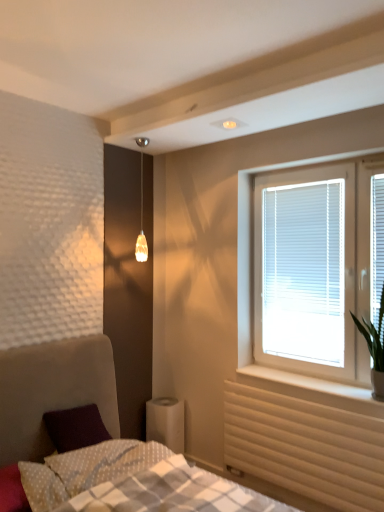
Describe the element at coordinates (98, 444) in the screenshot. I see `white textured bed at lower left` at that location.

This screenshot has height=512, width=384. What do you see at coordinates (251, 243) in the screenshot? I see `white blinds at right` at bounding box center [251, 243].

In order to face white wood window sill at lower right, should I rotate leftwards or rightwards?

To face it directly, rotate right by 15.425 degrees.

I want to click on white wood window sill at lower right, so click(x=312, y=389).

You are a GUI agent. You are given a task and a screenshot of the screen. Output one action in this format:
    pyautogui.click(x=<x>, y=<y>)
    Task: Click on the translucent amber glass pendant light at upper center
    The height and width of the screenshot is (512, 384).
    Given the screenshot: What is the action you would take?
    pyautogui.click(x=141, y=229)

Considering the positions of objects white blinds at right and translucent amber glass pendant light at upper center in the image provided, who is more to the left, white blinds at right or translucent amber glass pendant light at upper center?

translucent amber glass pendant light at upper center is more to the left.

Does point (237, 324) lie behind point (147, 252)?

No, (237, 324) is in front of (147, 252).

From the image's perspective, is white blinds at right located above or below translucent amber glass pendant light at upper center?

From the image's perspective, white blinds at right appears below translucent amber glass pendant light at upper center.

Would you say translucent amber glass pendant light at upper center is part of white blinds at right's contents?

No.

This screenshot has width=384, height=512. I want to click on bed above the white dotted fabric pillow at lower left, the 2th pillow positioned from the right (from a real-world perspective), so click(98, 444).

Is white dotted fabric pillow at lower left, the 2th pillow positioned from the right, not close to white textured bed at lower left?

That's not correct — white dotted fabric pillow at lower left, the 2th pillow positioned from the right, is a little close to white textured bed at lower left.

Is point (58, 493) closer or farther from the camera than point (237, 509)?

Point (58, 493).

From the image's perspective, would you say white dotted fabric pillow at lower left, which is counted as the 1th pillow, starting from the left, is positioned over white textured bed at lower left?

No, from the image's perspective, white dotted fabric pillow at lower left, which is counted as the 1th pillow, starting from the left, is not on top of white textured bed at lower left.

Is translucent amber glass pendant light at upper center turned away from white dotted fabric pillow at lower left, which is counted as the 1th pillow, starting from the left?

No, translucent amber glass pendant light at upper center's orientation is not away from white dotted fabric pillow at lower left, which is counted as the 1th pillow, starting from the left.

Which is closer to the camera, (142, 147) or (62, 488)?

Positioned in front is point (62, 488).

Is translucent amber glass pendant light at upper center positioned beyond the bounds of white dotted fabric pillow at lower left, the 2th pillow positioned from the right?

Absolutely, translucent amber glass pendant light at upper center is external to white dotted fabric pillow at lower left, the 2th pillow positioned from the right.

Looking at the image, does translucent amber glass pendant light at upper center seem bigger or smaller compared to white dotted fabric pillow at lower left, the 2th pillow positioned from the right?

Considering their sizes, translucent amber glass pendant light at upper center takes up less space than white dotted fabric pillow at lower left, the 2th pillow positioned from the right.

Is white plastic blinds at upper right, the second window screen from the front, far from white dotted fabric pillow at lower left, the 2th pillow positioned from the right?

That's right, there is a large distance between white plastic blinds at upper right, the second window screen from the front, and white dotted fabric pillow at lower left, the 2th pillow positioned from the right.

Between white plastic blinds at upper right, positioned as the first window screen in back-to-front order, and white dotted fabric pillow at lower left, the 2th pillow positioned from the right, which one has smaller size?

With smaller size is white dotted fabric pillow at lower left, the 2th pillow positioned from the right.

From their relative heights in the image, would you say white plastic blinds at upper right, the second window screen from the front, is taller or shorter than white dotted fabric pillow at lower left, the 2th pillow positioned from the right?

Clearly, white plastic blinds at upper right, the second window screen from the front, is taller compared to white dotted fabric pillow at lower left, the 2th pillow positioned from the right.

Is the depth of white plastic blinds at upper right, arranged as the second window screen when viewed from the right, greater than that of white dotted fabric pillow at lower left, the 2th pillow positioned from the right?

Yes, it is behind white dotted fabric pillow at lower left, the 2th pillow positioned from the right.

Which is correct: white plastic blinds at right, placed as the 2th window screen when sorted from left to right, is inside white plastic blinds at upper right, arranged as the second window screen when viewed from the right, or outside of it?

white plastic blinds at right, placed as the 2th window screen when sorted from left to right, is not enclosed by white plastic blinds at upper right, arranged as the second window screen when viewed from the right.

From a real-world perspective, does white plastic blinds at right, which appears as the first window screen when viewed from the right, sit lower than white plastic blinds at upper right, positioned as the first window screen in back-to-front order?

Incorrect, from a real-world perspective, white plastic blinds at right, which appears as the first window screen when viewed from the right, is higher than white plastic blinds at upper right, positioned as the first window screen in back-to-front order.

Considering the sizes of white plastic blinds at right, placed as the 2th window screen when sorted from left to right, and white plastic blinds at upper right, arranged as the second window screen when viewed from the right, in the image, is white plastic blinds at right, placed as the 2th window screen when sorted from left to right, taller or shorter than white plastic blinds at upper right, arranged as the second window screen when viewed from the right,?

white plastic blinds at right, placed as the 2th window screen when sorted from left to right, is shorter than white plastic blinds at upper right, arranged as the second window screen when viewed from the right.

Can you see white plastic blinds at right, placed as the 2th window screen when sorted from left to right, touching white plastic blinds at upper right, positioned as the first window screen in back-to-front order?

No.

Is white textured bed at lower left not near velvet purple pillow at lower left, which is the 1th pillow in right-to-left order?

No.

Based on their sizes in the image, would you say white textured bed at lower left is bigger or smaller than velvet purple pillow at lower left, which is the 1th pillow in right-to-left order?

Considering their sizes, white textured bed at lower left takes up more space than velvet purple pillow at lower left, which is the 1th pillow in right-to-left order.

From the picture: Is white textured bed at lower left to the right of velvet purple pillow at lower left, positioned as the 2th pillow in left-to-right order, from the viewer's perspective?

Yes, white textured bed at lower left is to the right of velvet purple pillow at lower left, positioned as the 2th pillow in left-to-right order.

Which is closer to the camera, (x=142, y=462) or (x=157, y=454)?

The point (x=142, y=462) is more forward.

Is white dotted fabric pillow at lower left, which is counted as the 1th pillow, starting from the left, in contact with white plastic blinds at right, placed as the 2th window screen when sorted from left to right?

No, white dotted fabric pillow at lower left, which is counted as the 1th pillow, starting from the left, is not beside white plastic blinds at right, placed as the 2th window screen when sorted from left to right.

Between white dotted fabric pillow at lower left, which is counted as the 1th pillow, starting from the left, and white plastic blinds at right, which appears as the first window screen when viewed from the right, which one has smaller size?

Smaller between the two is white plastic blinds at right, which appears as the first window screen when viewed from the right.

Is white dotted fabric pillow at lower left, which is counted as the 1th pillow, starting from the left, positioned with its back to white plastic blinds at right, which appears as the first window screen when viewed from the right?

No, white dotted fabric pillow at lower left, which is counted as the 1th pillow, starting from the left, is not facing away from white plastic blinds at right, which appears as the first window screen when viewed from the right.

The image size is (384, 512). What are the coordinates of `lamp that is above the white blinds at right (from the image's perspective)` in the screenshot? It's located at (141, 229).

Find the location of a particular element. This screenshot has height=512, width=384. bed in front of the white dotted fabric pillow at lower left, which is counted as the 1th pillow, starting from the left is located at coordinates (98, 444).

Looking at the image, which one is located closer to white plastic blinds at right, which is the first window screen from front to back, white dotted fabric pillow at lower left, which is counted as the 1th pillow, starting from the left, or translucent amber glass pendant light at upper center?

Among the two, translucent amber glass pendant light at upper center is located nearer to white plastic blinds at right, which is the first window screen from front to back.

From the image, which object appears to be nearer to white wood window sill at lower right, white plastic blinds at upper right, the second window screen from the front, or white textured bed at lower left?

white plastic blinds at upper right, the second window screen from the front.

When comparing their distances from white dotted fabric pillow at lower left, the 2th pillow positioned from the right, does translucent amber glass pendant light at upper center or beige textured radiator at lower right seem closer?

The object closer to white dotted fabric pillow at lower left, the 2th pillow positioned from the right, is beige textured radiator at lower right.

Looking at the image, which one is located further to white dotted fabric pillow at lower left, which is counted as the 1th pillow, starting from the left, white textured bed at lower left or white plastic blinds at upper right, marked as the first window screen in a left-to-right arrangement?

white plastic blinds at upper right, marked as the first window screen in a left-to-right arrangement, is further to white dotted fabric pillow at lower left, which is counted as the 1th pillow, starting from the left.

When comparing their distances from translucent amber glass pendant light at upper center, does white textured bed at lower left or beige textured radiator at lower right seem closer?

white textured bed at lower left lies closer to translucent amber glass pendant light at upper center than the other object.

From the picture: Estimate the real-world distances between objects in this image. Which object is closer to translucent amber glass pendant light at upper center, velvet purple pillow at lower left, which is the 1th pillow in right-to-left order, or white dotted fabric pillow at lower left, the 2th pillow positioned from the right?

The object closer to translucent amber glass pendant light at upper center is velvet purple pillow at lower left, which is the 1th pillow in right-to-left order.

From the image, which object appears to be nearer to white plastic blinds at right, which is the first window screen from front to back, white blinds at right or beige textured radiator at lower right?

white blinds at right lies closer to white plastic blinds at right, which is the first window screen from front to back, than the other object.

Which object lies further to the anchor point white plastic blinds at right, which appears as the first window screen when viewed from the right, white blinds at right or white dotted fabric pillow at lower left, the 2th pillow positioned from the right?

white dotted fabric pillow at lower left, the 2th pillow positioned from the right, is positioned further to the anchor white plastic blinds at right, which appears as the first window screen when viewed from the right.

Find the location of `pillow located between white dotted fabric pillow at lower left, the 2th pillow positioned from the right, and beige textured radiator at lower right in the left-right direction`. pillow located between white dotted fabric pillow at lower left, the 2th pillow positioned from the right, and beige textured radiator at lower right in the left-right direction is located at coordinates (104, 462).

You are a GUI agent. You are given a task and a screenshot of the screen. Output one action in this format:
    pyautogui.click(x=<x>, y=<y>)
    Task: Click on the window sill between white plastic blinds at right, placed as the 2th window screen when sorted from left to right, and beige textured radiator at lower right from top to bottom
    The height and width of the screenshot is (512, 384).
    Given the screenshot: What is the action you would take?
    pyautogui.click(x=312, y=389)

Image resolution: width=384 pixels, height=512 pixels. Identify the location of radiator located between white dotted fabric pillow at lower left, which is counted as the 1th pillow, starting from the left, and white plastic blinds at right, which is the 2th window screen from back to front, in the left-right direction. (305, 447).

Where is `window screen between velvet purple pillow at lower left, which is the 1th pillow in right-to-left order, and white blinds at right`? The width and height of the screenshot is (384, 512). window screen between velvet purple pillow at lower left, which is the 1th pillow in right-to-left order, and white blinds at right is located at coordinates (304, 271).